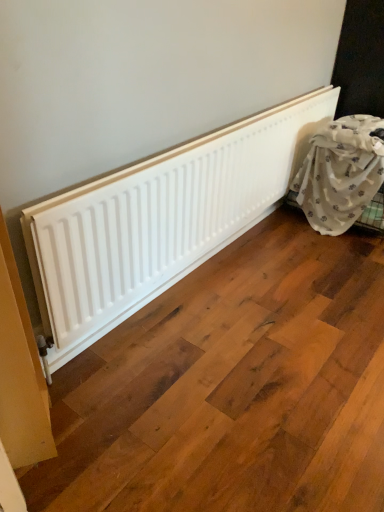
Image resolution: width=384 pixels, height=512 pixels. Describe the element at coordinates (160, 220) in the screenshot. I see `white matte radiator at center` at that location.

I want to click on white matte radiator at center, so click(x=160, y=220).

What do you see at coordinates (343, 176) in the screenshot? I see `white fabric at right` at bounding box center [343, 176].

Identify the location of white fabric at right. The image size is (384, 512). point(343,176).

Where is `white matte radiator at center`? Image resolution: width=384 pixels, height=512 pixels. white matte radiator at center is located at coordinates (160, 220).

Is white matte radiator at center to the left or to the right of white fabric at right in the image?

white matte radiator at center is positioned on white fabric at right's left side.

Is white matte radiator at center positioned in front of white fabric at right?

Yes, it is.

Does point (227, 160) come farther from viewer compared to point (382, 152)?

No, (227, 160) is closer to viewer.

From the image's perspective, is white matte radiator at center located beneath white fabric at right?

Yes, from the image's perspective, white matte radiator at center is below white fabric at right.

Consider the image. From a real-world perspective, is white matte radiator at center positioned under white fabric at right based on gravity?

No, from a real-world perspective, white matte radiator at center is not below white fabric at right.

Looking at their sizes, would you say white matte radiator at center is wider or thinner than white fabric at right?

Clearly, white matte radiator at center has less width compared to white fabric at right.

Does white matte radiator at center have a greater height compared to white fabric at right?

In fact, white matte radiator at center may be shorter than white fabric at right.

From the picture: Between white matte radiator at center and white fabric at right, which one has smaller size?

white matte radiator at center.

Is white matte radiator at center inside or outside of white fabric at right?

white matte radiator at center cannot be found inside white fabric at right.

Is there a large distance between white matte radiator at center and white fabric at right?

No, white matte radiator at center is not far away from white fabric at right.

Could you tell me if white matte radiator at center is turned towards white fabric at right?

Yes.

How different are the orientations of white matte radiator at center and white fabric at right in degrees?

1.49 degrees separate the facing orientations of white matte radiator at center and white fabric at right.

At what (x,y) coordinates should I click in order to perform the action: click on radiator that appears above the white fabric at right (from a real-world perspective). Please return your answer as a coordinate pair (x, y). Looking at the image, I should click on (160, 220).

Would you say white fabric at right is to the left or to the right of white matte radiator at center in the picture?

Based on their positions, white fabric at right is located to the right of white matte radiator at center.

Is the position of white fabric at right less distant than that of white matte radiator at center?

No.

Is point (362, 150) more distant than point (117, 253)?

Yes, it is.

From the image's perspective, is white fabric at right located beneath white matte radiator at center?

No, from the image's perspective, white fabric at right is not beneath white matte radiator at center.

From a real-world perspective, which object stands above the other?

white matte radiator at center, from a real-world perspective.

Can you confirm if white fabric at right is wider than white matte radiator at center?

Yes.

Who is shorter, white fabric at right or white matte radiator at center?

white matte radiator at center is shorter.

Considering the relative sizes of white fabric at right and white matte radiator at center in the image provided, is white fabric at right smaller than white matte radiator at center?

Actually, white fabric at right might be larger than white matte radiator at center.

Can we say white fabric at right lies outside white matte radiator at center?

Yes, white fabric at right is located beyond the bounds of white matte radiator at center.

Is white fabric at right placed right next to white matte radiator at center?

white fabric at right and white matte radiator at center are clearly separated.

Looking at this image, is white fabric at right facing towards white matte radiator at center?

No, white fabric at right is not turned towards white matte radiator at center.

You are a GUI agent. You are given a task and a screenshot of the screen. Output one action in this format:
    pyautogui.click(x=<x>, y=<y>)
    Task: Click on the furniture behind the white matte radiator at center
    
    Given the screenshot: What is the action you would take?
    pyautogui.click(x=343, y=176)

Locate an element on the screen. This screenshot has width=384, height=512. radiator below the white fabric at right (from the image's perspective) is located at coordinates (160, 220).

Image resolution: width=384 pixels, height=512 pixels. Identify the location of radiator above the white fabric at right (from a real-world perspective). (160, 220).